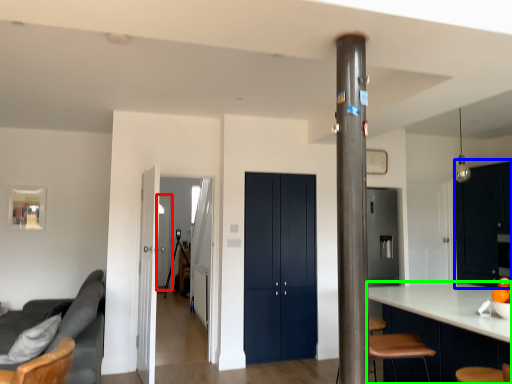
Question: Based on their relative distances, which object is nearer to glass door (highlighted by a red box)? Choose from dresser (highlighted by a blue box) and cabinetry (highlighted by a green box).

Choices:
 (A) dresser
 (B) cabinetry

Answer: (A)